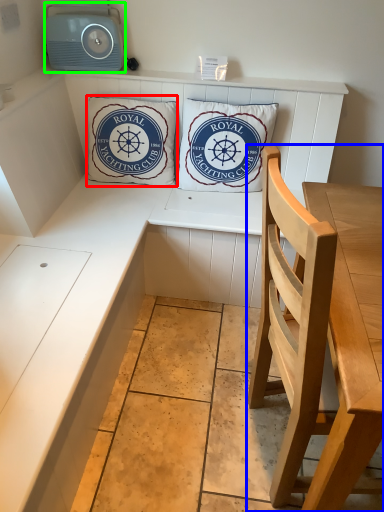
Question: Which is nearer to the pillow (highlighted by a red box)? chair (highlighted by a blue box) or stereo (highlighted by a green box).

Choices:
 (A) chair
 (B) stereo

Answer: (B)